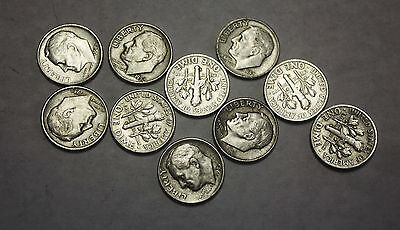
In order to click on table in this screenshot , I will do `click(273, 181)`.